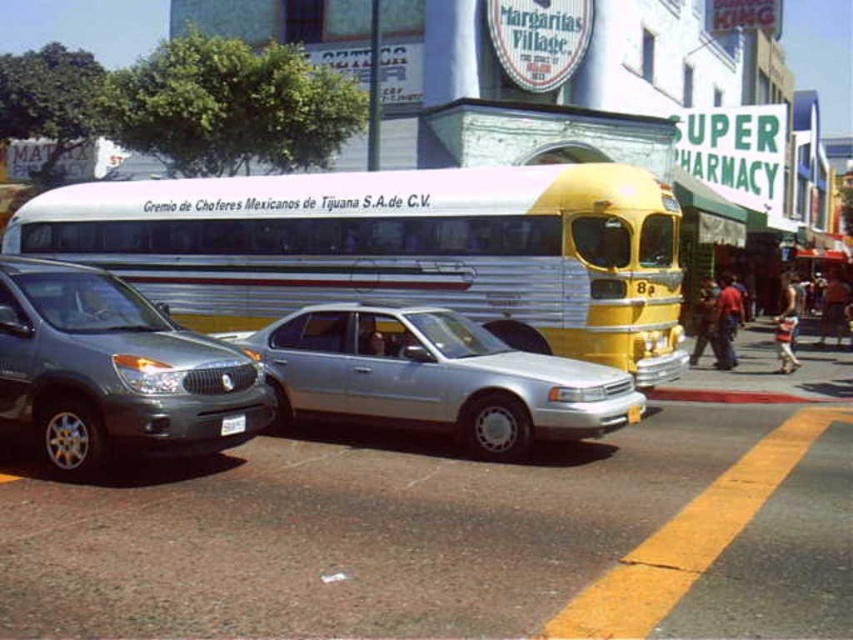
Which is behind, point (120, 321) or point (645, 387)?

The point (645, 387) is behind.

Who is higher up, satin silver suv at left or smooth concrete curb at lower right?

Positioned higher is satin silver suv at left.

Where is `satin silver suv at left`? The width and height of the screenshot is (853, 640). satin silver suv at left is located at coordinates (113, 371).

Locate an element on the screen. This screenshot has width=853, height=640. satin silver suv at left is located at coordinates coord(113,371).

Is silver metallic bus at center taller than smooth concrete curb at lower right?

Yes.

Is silver metallic bus at center further to camera compared to smooth concrete curb at lower right?

No.

Where is `silver metallic bus at center`? This screenshot has width=853, height=640. silver metallic bus at center is located at coordinates (393, 248).

Who is more distant from viewer, (364, 381) or (670, 392)?

The point (670, 392) is more distant.

Is point (544, 419) more distant than point (741, 394)?

No, (544, 419) is in front of (741, 394).

The height and width of the screenshot is (640, 853). Identify the location of silver metallic sedan at center. (434, 376).